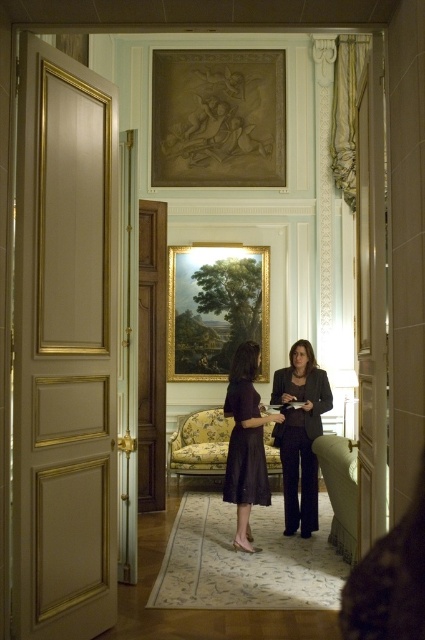
Which is more to the left, matte black dress at center or black satin dress at center?

From the viewer's perspective, black satin dress at center appears more on the left side.

Who is positioned more to the right, matte black dress at center or black satin dress at center?

matte black dress at center is more to the right.

Is point (258, 429) positioned before point (255, 492)?

No, (258, 429) is further to viewer.

Identify the location of matte black dress at center. (246, 442).

Is point (285, 452) positioned in front of point (252, 548)?

No, (285, 452) is behind (252, 548).

Who is more distant from viewer, (328, 401) or (243, 516)?

Positioned behind is point (328, 401).

The width and height of the screenshot is (425, 640). I want to click on matte black blazer at center, so coord(300,435).

Consider the image. Does matte black blazer at center have a lesser width compared to black satin dress at center?

In fact, matte black blazer at center might be wider than black satin dress at center.

Which is behind, point (272, 381) or point (238, 476)?

Positioned behind is point (272, 381).

This screenshot has height=640, width=425. I want to click on matte black blazer at center, so click(300, 435).